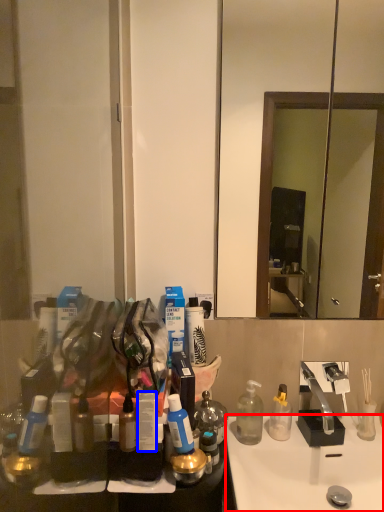
Question: Which object is further to the camera taking this photo, sink (highlighted by a red box) or toiletry (highlighted by a blue box)?

Choices:
 (A) sink
 (B) toiletry

Answer: (A)